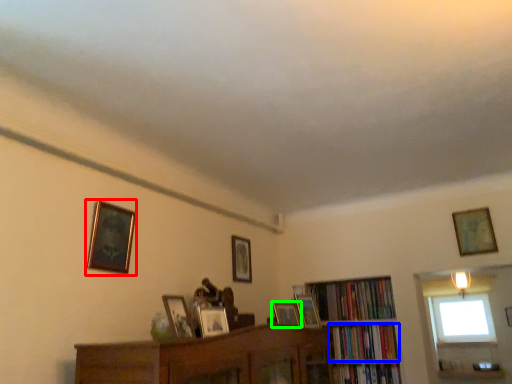
Question: Considering the real-world distances, which object is closest to picture frame (highlighted by a red box)? book (highlighted by a blue box) or picture frame (highlighted by a green box).

Choices:
 (A) book
 (B) picture frame

Answer: (B)